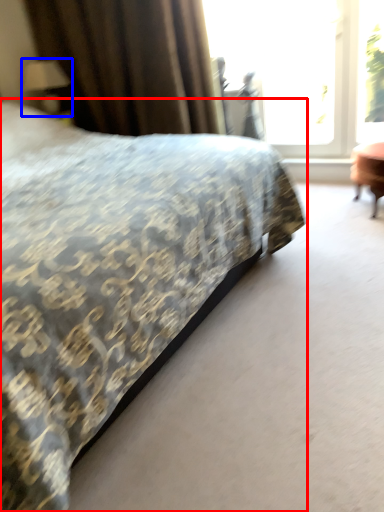
Question: Which point is further to the camera, bed (highlighted by a red box) or table lamp (highlighted by a blue box)?

Choices:
 (A) bed
 (B) table lamp

Answer: (B)